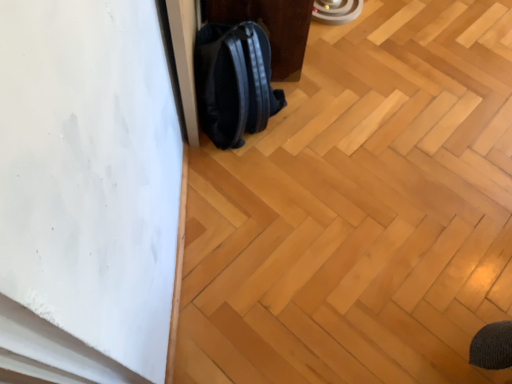
Locate an element on the screen. Image resolution: width=512 pixels, height=384 pixels. free spot to the right of black matte backpack at center is located at coordinates (329, 126).